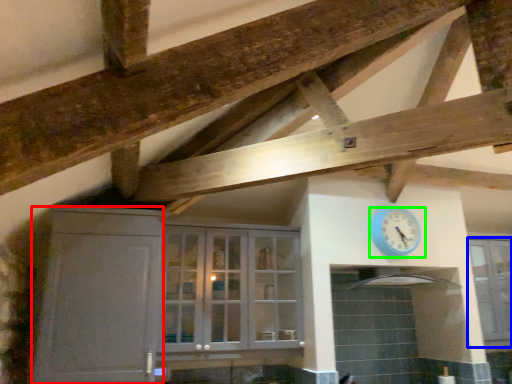
Question: Which object is the closest to the cabinetry (highlighted by a red box)? Choose among these: window (highlighted by a blue box) or wall clock (highlighted by a green box).

Choices:
 (A) window
 (B) wall clock

Answer: (B)